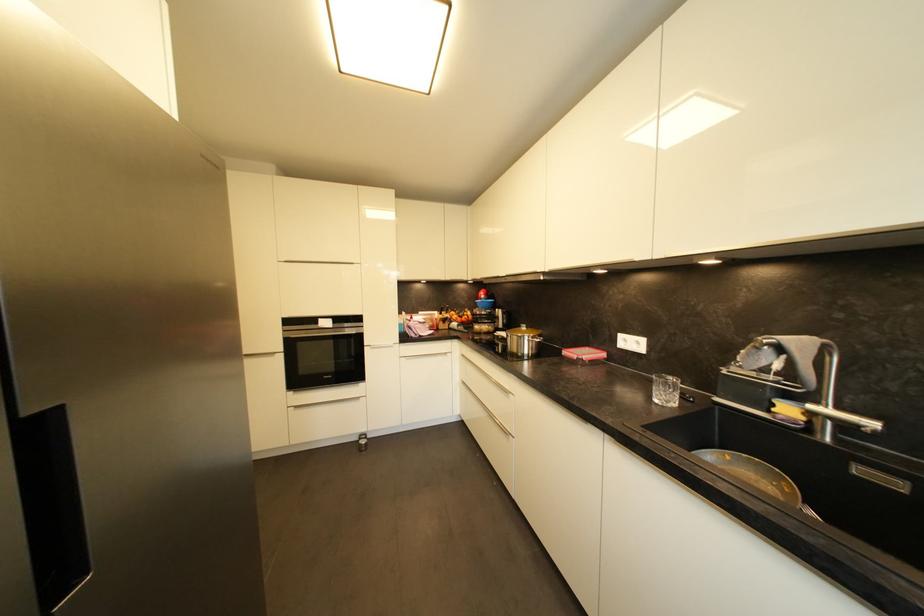
I want to click on cooking pot handle, so click(x=523, y=342).